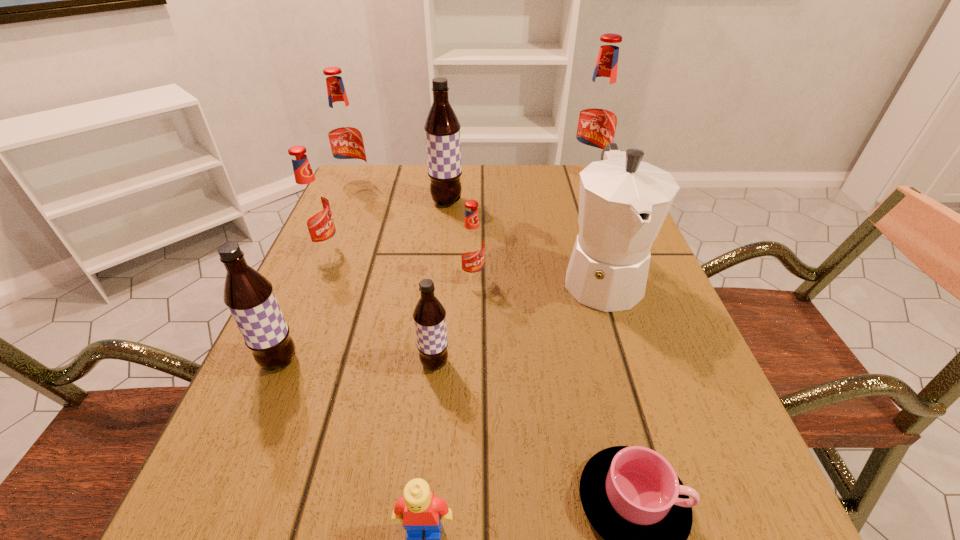
Select which brown root beer appears as the second closest to the farthest brown root beer. Please provide its 2D coordinates. Your answer should be formatted as a tuple, i.e. [(x, y)], where the tuple contains the x and y coordinates of a point satisfying the conditions above.

[(249, 296)]

Locate an element on the screen. The image size is (960, 540). the second closest brown root beer to the fourth nearest root beer is located at coordinates (249, 296).

Locate an element on the screen. The height and width of the screenshot is (540, 960). free space that satisfies the following two spatial constraints: 1. on the back side of the third farthest red root beer; 2. on the right side of the biggest brown root beer is located at coordinates (347, 202).